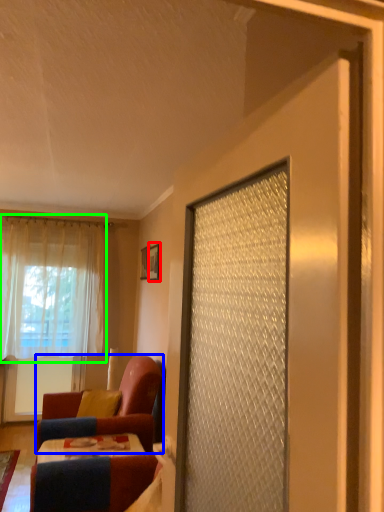
Question: Based on their relative distances, which object is nearer to picture frame (highlighted by a red box)? Choose from chair (highlighted by a blue box) and curtain (highlighted by a green box).

Choices:
 (A) chair
 (B) curtain

Answer: (A)